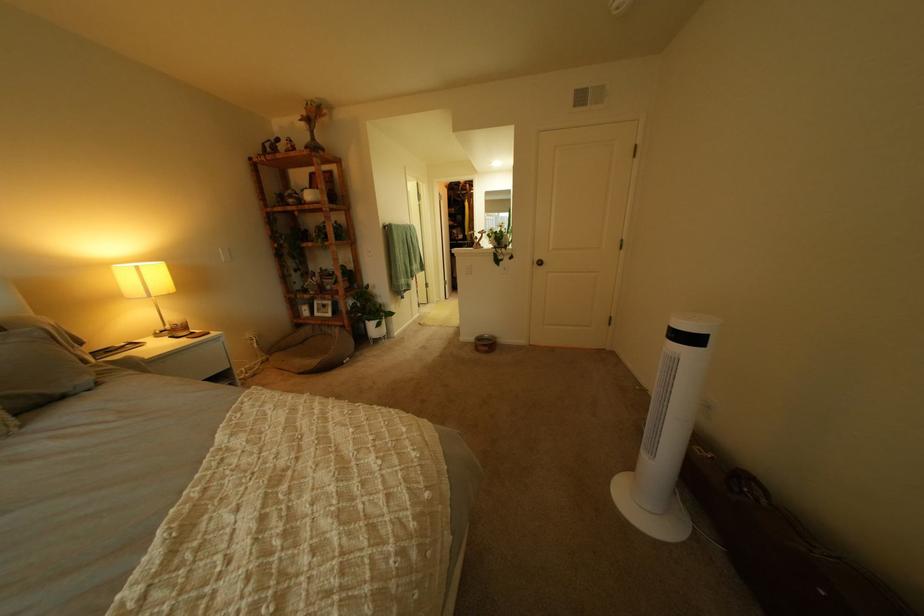
Which object does [98,487] point to?

It refers to a brown pet bed.